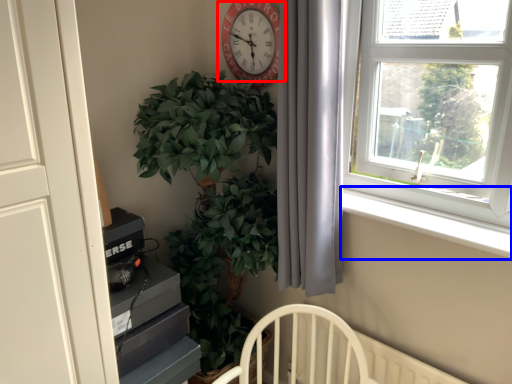
Question: Which object appears closest to the camera in this image, wall clock (highlighted by a red box) or window sill (highlighted by a blue box)?

Choices:
 (A) wall clock
 (B) window sill

Answer: (B)